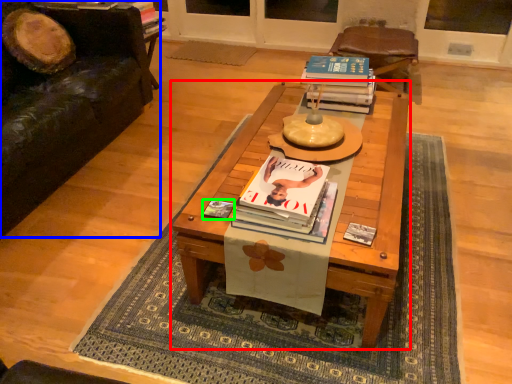
Question: Which object is the farthest from coffee table (highlighted by a red box)? Choose among these: studio couch (highlighted by a blue box) or magazine (highlighted by a green box).

Choices:
 (A) studio couch
 (B) magazine

Answer: (A)